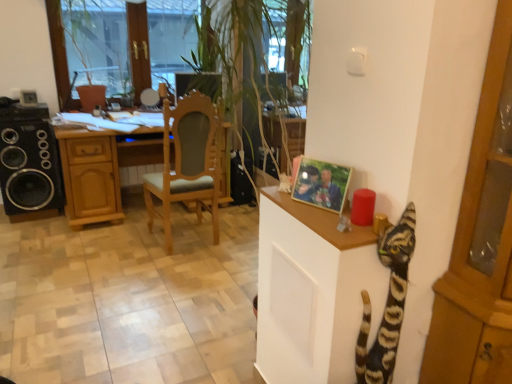
Question: Is light brown wood chair at center looking in the opposite direction of striped fur cat at right?

Choices:
 (A) no
 (B) yes

Answer: (B)

Question: Is light brown wood chair at center positioned in front of striped fur cat at right?

Choices:
 (A) yes
 (B) no

Answer: (B)

Question: Can you confirm if light brown wood chair at center is positioned to the right of striped fur cat at right?

Choices:
 (A) no
 (B) yes

Answer: (A)

Question: From the image's perspective, does light brown wood chair at center appear lower than striped fur cat at right?

Choices:
 (A) yes
 (B) no

Answer: (B)

Question: From a real-world perspective, does light brown wood chair at center stand above striped fur cat at right?

Choices:
 (A) yes
 (B) no

Answer: (B)

Question: Does light brown wood chair at center have a lesser width compared to striped fur cat at right?

Choices:
 (A) no
 (B) yes

Answer: (A)

Question: Is transparent glass window at upper center at the left side of black matte speaker at left?

Choices:
 (A) no
 (B) yes

Answer: (A)

Question: Is transparent glass window at upper center positioned far away from black matte speaker at left?

Choices:
 (A) no
 (B) yes

Answer: (A)

Question: Considering the relative sizes of transparent glass window at upper center and black matte speaker at left in the image provided, is transparent glass window at upper center bigger than black matte speaker at left?

Choices:
 (A) no
 (B) yes

Answer: (B)

Question: Does transparent glass window at upper center have a greater height compared to black matte speaker at left?

Choices:
 (A) yes
 (B) no

Answer: (A)

Question: Is transparent glass window at upper center completely or partially outside of black matte speaker at left?

Choices:
 (A) yes
 (B) no

Answer: (A)

Question: Can you confirm if transparent glass window at upper center is wider than black matte speaker at left?

Choices:
 (A) no
 (B) yes

Answer: (A)

Question: Is striped fur cat at right to the right of light brown wood chair at center from the viewer's perspective?

Choices:
 (A) yes
 (B) no

Answer: (A)